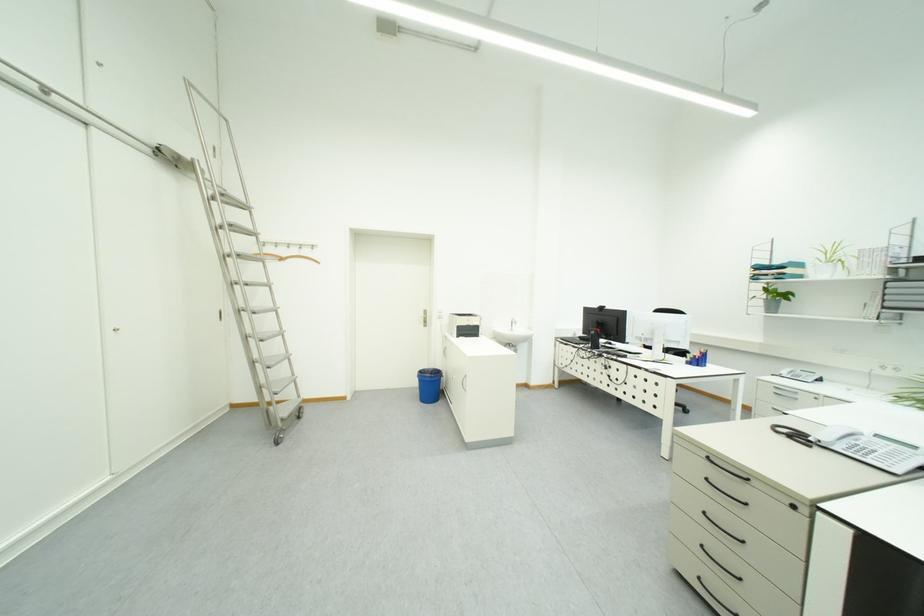
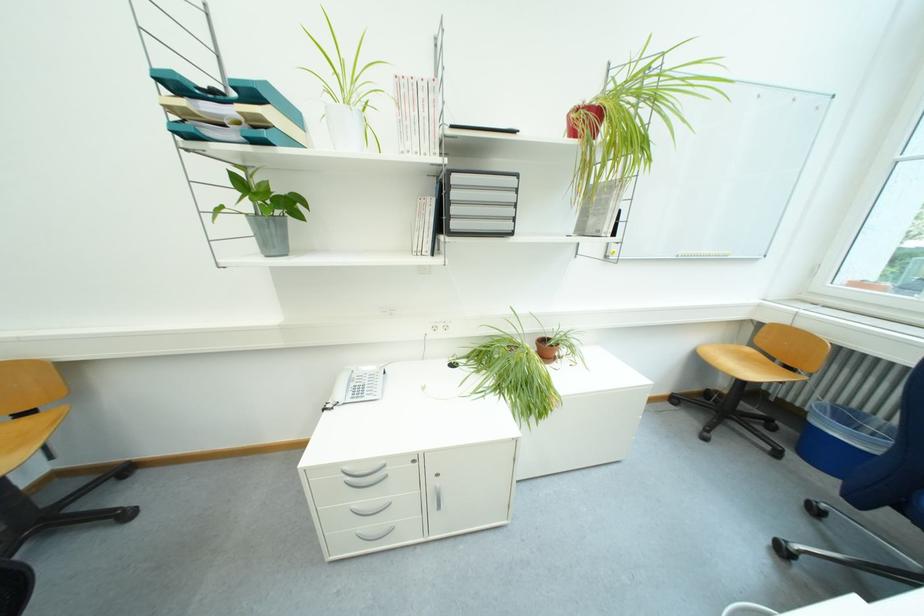
Find the pixel in the second image that matches (796,374) in the first image.

(351, 395)